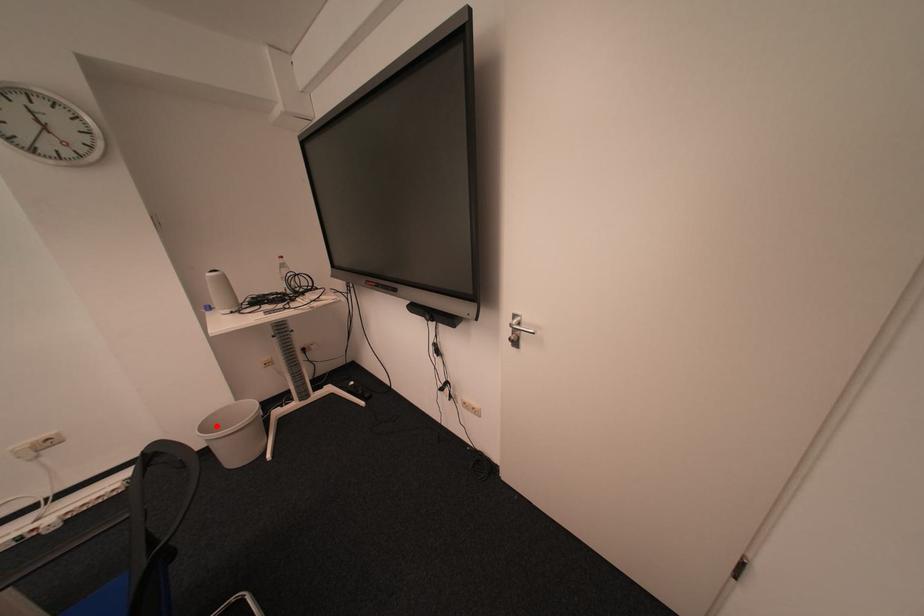
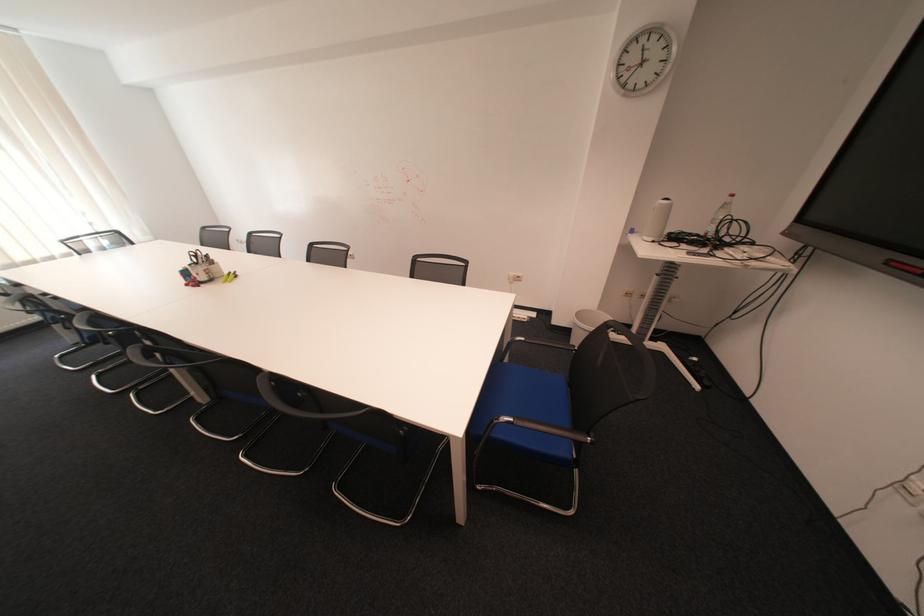
Find the pixel in the second image that matches the highlighted location in the first image.

(590, 315)